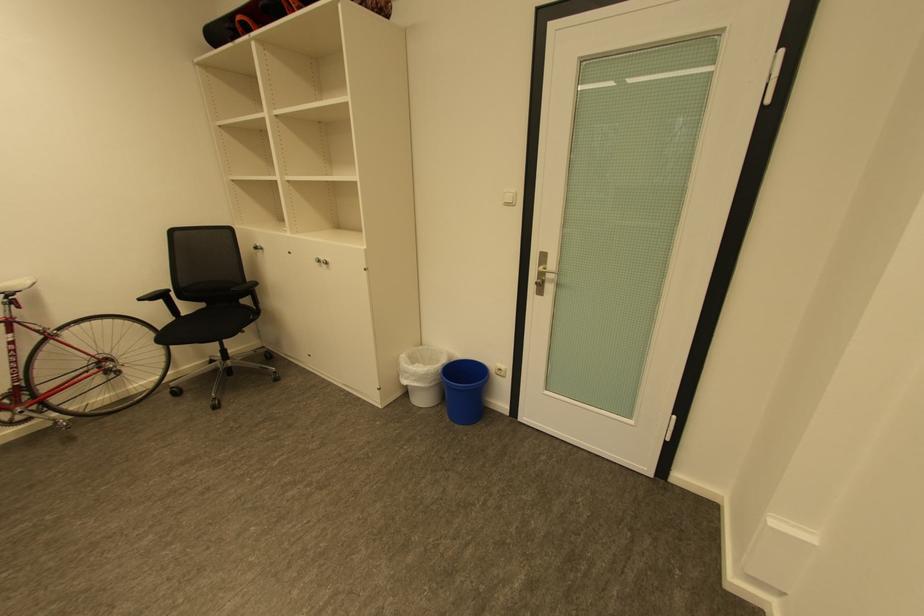
Locate an element on the screen. blue trash can is located at coordinates (465, 390).